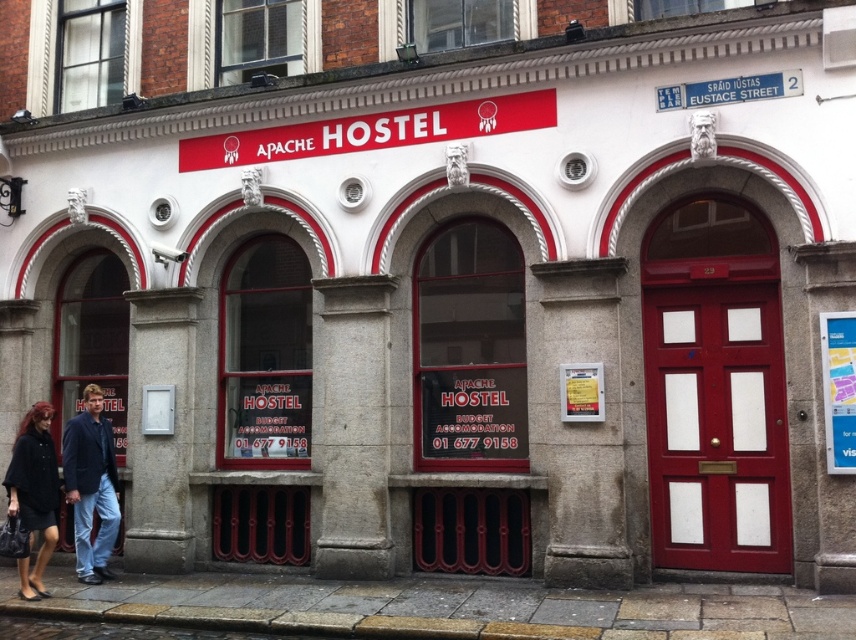
Is brown stone pavement at lower center positioned behind dark blue denim jeans at lower left?

That is False.

Can you confirm if brown stone pavement at lower center is positioned below dark blue denim jeans at lower left?

Indeed, brown stone pavement at lower center is positioned under dark blue denim jeans at lower left.

Who is more forward, (66,577) or (107,577)?

Point (107,577) is more forward.

Locate an element on the screen. This screenshot has height=640, width=856. brown stone pavement at lower center is located at coordinates (441, 605).

Between point (120, 596) and point (49, 540), which one is positioned behind?

The point (120, 596) is behind.

Between brown stone pavement at lower center and black fabric coat at lower left, which one has more height?

With more height is black fabric coat at lower left.

Image resolution: width=856 pixels, height=640 pixels. What do you see at coordinates (441, 605) in the screenshot?
I see `brown stone pavement at lower center` at bounding box center [441, 605].

Locate an element on the screen. The image size is (856, 640). brown stone pavement at lower center is located at coordinates (441, 605).

Measure the distance from blue denim jeans at lower left to black fabric coat at lower left.

blue denim jeans at lower left and black fabric coat at lower left are 17.72 inches apart.

Which of these two, blue denim jeans at lower left or black fabric coat at lower left, stands taller?

blue denim jeans at lower left is taller.

Does point (80, 572) lie in front of point (28, 497)?

No, (80, 572) is behind (28, 497).

The height and width of the screenshot is (640, 856). I want to click on blue denim jeans at lower left, so click(x=91, y=484).